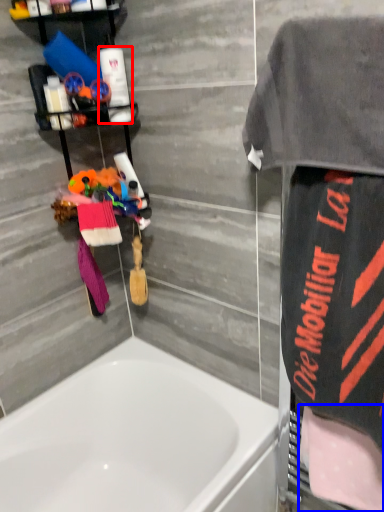
Question: Which of the following is the farthest to the observer, toiletry (highlighted by a red box) or beach towel (highlighted by a blue box)?

Choices:
 (A) toiletry
 (B) beach towel

Answer: (A)